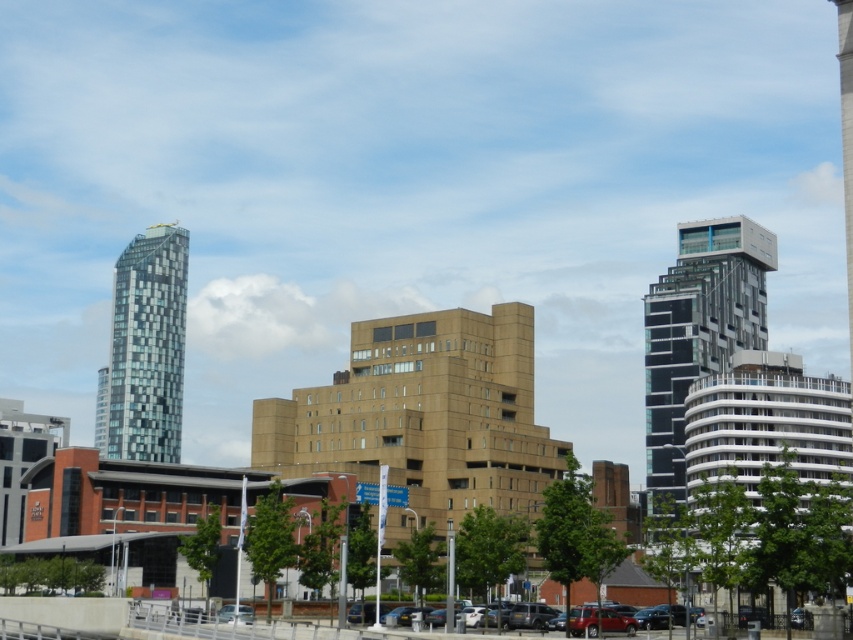
You are a delivery driver who needs to park your matte red car at lower center near the black glass tower at right. Based on the scene description, can you determine if the parking spot between them is wide enough for your car?

The black glass tower at right is to the right of the matte red car at lower center, so the parking spot between them is not wide enough for the car.